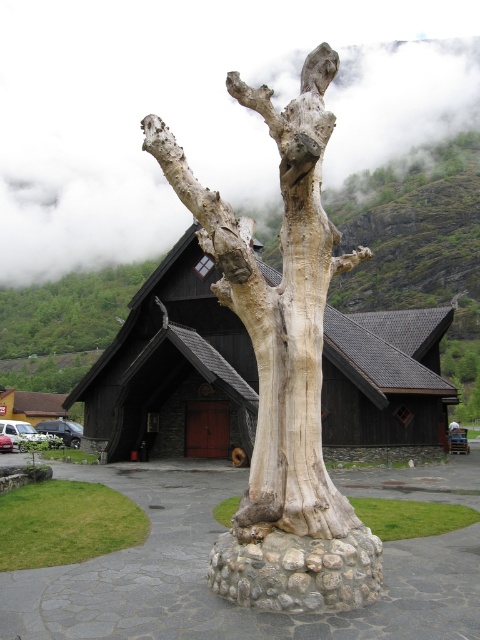
Question: Can you confirm if smooth gray bark at center is positioned below wooden hut at lower left?

Choices:
 (A) no
 (B) yes

Answer: (A)

Question: Which point is closer to the camera taking this photo?

Choices:
 (A) (151, 365)
 (B) (312, 81)
 (C) (290, 420)
 (D) (476, 353)

Answer: (C)

Question: Can you confirm if dark wood/black shingles at center is positioned below wooden hut at lower left?

Choices:
 (A) no
 (B) yes

Answer: (A)

Question: Does white wood sculpture at center appear on the left side of light brown wood at center?

Choices:
 (A) no
 (B) yes

Answer: (B)

Question: Considering the real-world distances, which object is farthest from the light brown wood at center?

Choices:
 (A) white wood sculpture at center
 (B) dark wood/black shingles at center

Answer: (B)

Question: Which object is the closest to the wooden hut at lower left?

Choices:
 (A) light brown wood at center
 (B) smooth gray bark at center
 (C) dark wood/black shingles at center
 (D) white wood sculpture at center

Answer: (C)